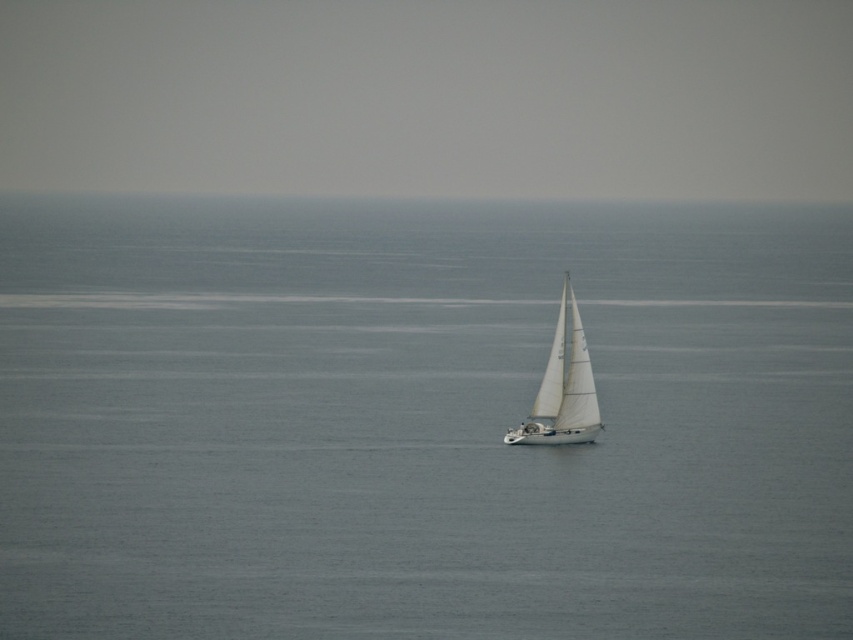
Who is positioned more to the left, gray water at center or white matte sailboat at center?

From the viewer's perspective, gray water at center appears more on the left side.

Can you confirm if gray water at center is positioned above white matte sailboat at center?

Yes, gray water at center is above white matte sailboat at center.

Between point (10, 256) and point (531, 435), which one is positioned in front?

Point (531, 435) is more forward.

The image size is (853, 640). Find the location of `gray water at center`. gray water at center is located at coordinates (419, 420).